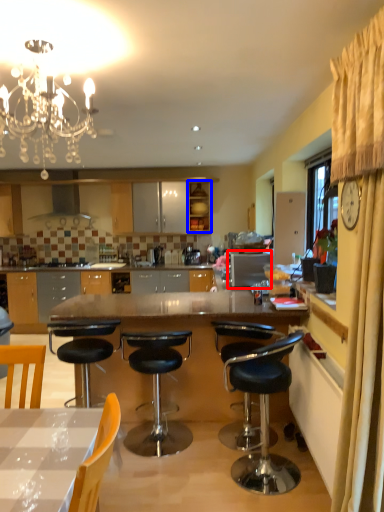
Question: Which of the following is the closest to the observer, appliance (highlighted by a red box) or cabinetry (highlighted by a blue box)?

Choices:
 (A) appliance
 (B) cabinetry

Answer: (A)